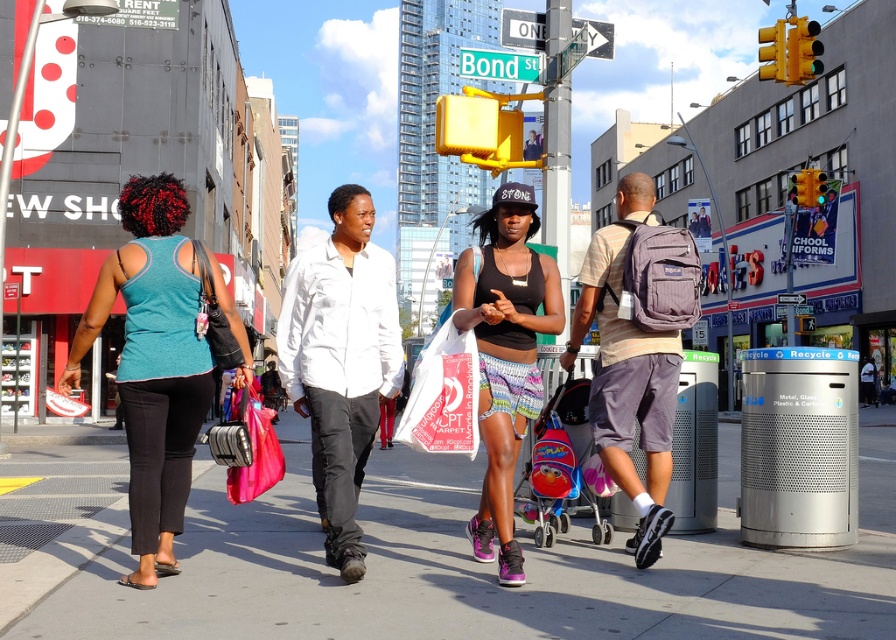
You are a delivery person trying to locate the white plastic bag at center in the image. The scene includes a woman wearing a matte black tank top at center. Based on the description, which object is higher up in the image?

The matte black tank top at center is much taller than the white plastic bag at center, so the matte black tank top at center is higher up in the image.

You are a photographer standing on Bond St. You see a white matte shirt at center and a white plastic bag at center. Which object is closer to you?

The white matte shirt at center is closer to you because the white plastic bag at center is behind it.

You are a street artist planning to paint a mural on the wall behind the matte black tank top at center and the matte purple backpack at center right. Which object should you avoid painting over to ensure the backpack remains visible?

The matte black tank top at center is larger in size than the matte purple backpack at center right, so painting over the larger matte black tank top at center might obscure the smaller matte purple backpack at center right. Therefore, avoid painting over the matte black tank top at center to keep the backpack visible.